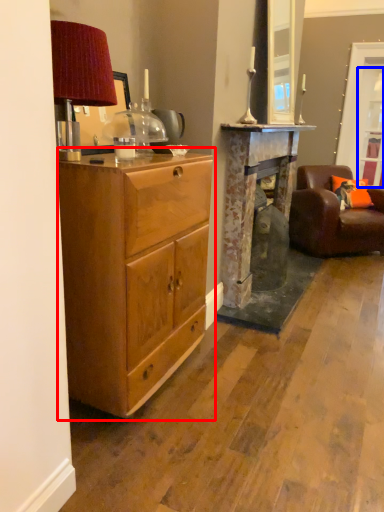
Question: Which object appears farthest to the camera in this image, cabinetry (highlighted by a red box) or glass door (highlighted by a blue box)?

Choices:
 (A) cabinetry
 (B) glass door

Answer: (B)